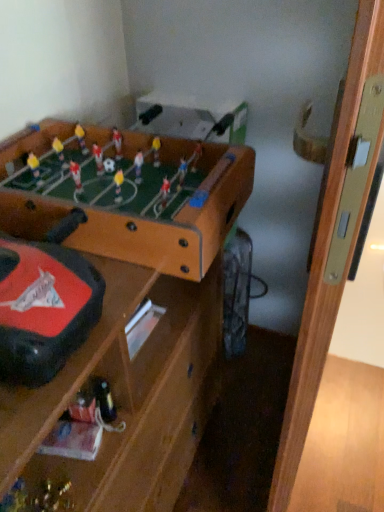
Question: From the image's perspective, is brown wooden table at upper left, positioned as the second table in bottom-to-top order, on top of metallic gold trophy at lower left?

Choices:
 (A) no
 (B) yes

Answer: (B)

Question: Considering the relative sizes of brown wooden table at upper left, which ranks as the first table in top-to-bottom order, and metallic gold trophy at lower left in the image provided, is brown wooden table at upper left, which ranks as the first table in top-to-bottom order, wider than metallic gold trophy at lower left?

Choices:
 (A) no
 (B) yes

Answer: (B)

Question: Does brown wooden table at upper left, which ranks as the first table in top-to-bottom order, turn towards metallic gold trophy at lower left?

Choices:
 (A) no
 (B) yes

Answer: (A)

Question: Is brown wooden table at upper left, which ranks as the first table in top-to-bottom order, smaller than metallic gold trophy at lower left?

Choices:
 (A) no
 (B) yes

Answer: (A)

Question: Is brown wooden table at upper left, which ranks as the first table in top-to-bottom order, with metallic gold trophy at lower left?

Choices:
 (A) no
 (B) yes

Answer: (A)

Question: From a real-world perspective, is brown wooden table at upper left, which ranks as the first table in top-to-bottom order, located beneath metallic gold trophy at lower left?

Choices:
 (A) no
 (B) yes

Answer: (A)

Question: Does metallic gold trophy at lower left appear on the left side of brown wooden table at upper left, positioned as the second table in bottom-to-top order?

Choices:
 (A) yes
 (B) no

Answer: (A)

Question: From the image's perspective, is metallic gold trophy at lower left on brown wooden table at upper left, which ranks as the first table in top-to-bottom order?

Choices:
 (A) no
 (B) yes

Answer: (A)

Question: From a real-world perspective, is metallic gold trophy at lower left below brown wooden table at upper left, which ranks as the first table in top-to-bottom order?

Choices:
 (A) no
 (B) yes

Answer: (B)

Question: From a real-world perspective, is metallic gold trophy at lower left positioned over brown wooden table at upper left, which ranks as the first table in top-to-bottom order, based on gravity?

Choices:
 (A) yes
 (B) no

Answer: (B)

Question: Is there a large distance between metallic gold trophy at lower left and brown wooden table at upper left, positioned as the second table in bottom-to-top order?

Choices:
 (A) yes
 (B) no

Answer: (B)

Question: Can brown wooden table at upper left, which ranks as the first table in top-to-bottom order, be found inside metallic gold trophy at lower left?

Choices:
 (A) yes
 (B) no

Answer: (B)

Question: Does brown wooden table at upper left, which ranks as the first table in top-to-bottom order, lie behind brown wooden table at center, the 2th table from the top?

Choices:
 (A) no
 (B) yes

Answer: (B)